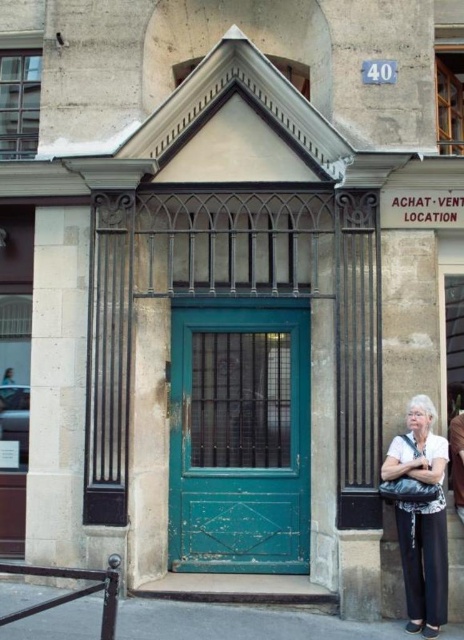
Who is higher up, green wooden door at center or white fabric at center?

green wooden door at center is above.

Who is lower down, green wooden door at center or white fabric at center?

Positioned lower is white fabric at center.

Which is behind, point (277, 556) or point (412, 509)?

Positioned behind is point (277, 556).

Find the location of a particular element. green wooden door at center is located at coordinates (239, 436).